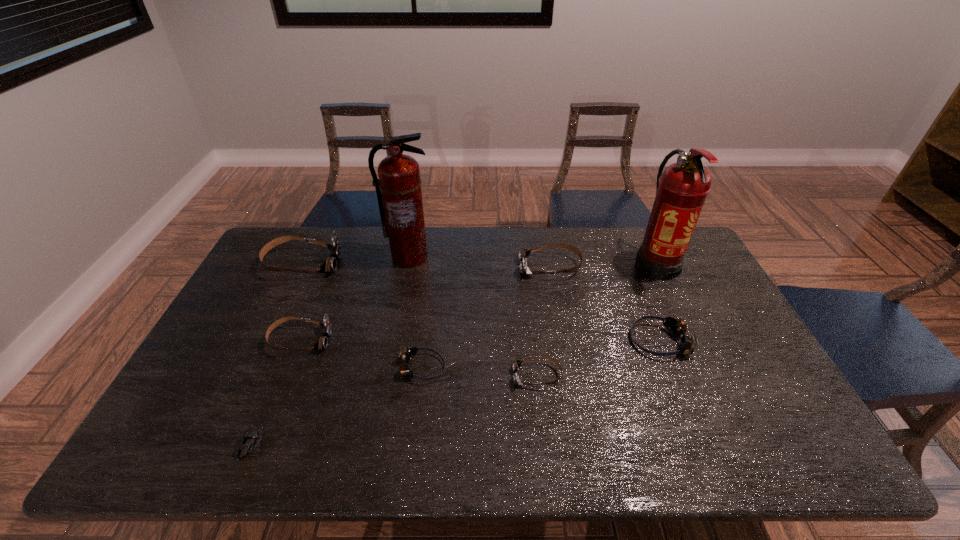
Find the location of a particular element. This screenshot has height=540, width=960. vacant space located 0.380m through the lenses of the bigger bronze goggles is located at coordinates 497,341.

Locate an element on the screen. Image resolution: width=960 pixels, height=540 pixels. vacant point located 0.080m through the lenses of the bigger bronze goggles is located at coordinates (602, 341).

Identify the location of free region located 0.260m on the front-facing side of the second smallest brown goggles. (420, 340).

You are a GUI agent. You are given a task and a screenshot of the screen. Output one action in this format:
    pyautogui.click(x=<x>, y=<y>)
    Task: Click on the free space located through the lenses of the smaller bronze goggles
    
    Given the screenshot: What is the action you would take?
    pyautogui.click(x=594, y=368)

Find the location of `free space located on the front-facing side of the nearest brown goggles`. free space located on the front-facing side of the nearest brown goggles is located at coordinates (396, 376).

Image resolution: width=960 pixels, height=540 pixels. Identify the location of vacant space situated 0.270m on the front-facing side of the nearest brown goggles. (411, 376).

What are the coordinates of `free region located on the front-facing side of the nearest brown goggles` in the screenshot? It's located at (442, 376).

At what (x,y) coordinates should I click in order to perform the action: click on blank space located on the right of the nearest object. Please return your answer as a coordinate pair (x, y). Image resolution: width=960 pixels, height=540 pixels. Looking at the image, I should click on (342, 445).

At what (x,y) coordinates should I click in order to perform the action: click on object situated at the near edge. Please return your answer as a coordinate pair (x, y). This screenshot has height=540, width=960. Looking at the image, I should click on (252, 437).

Where is `object at the left edge`? The width and height of the screenshot is (960, 540). object at the left edge is located at coordinates (330, 264).